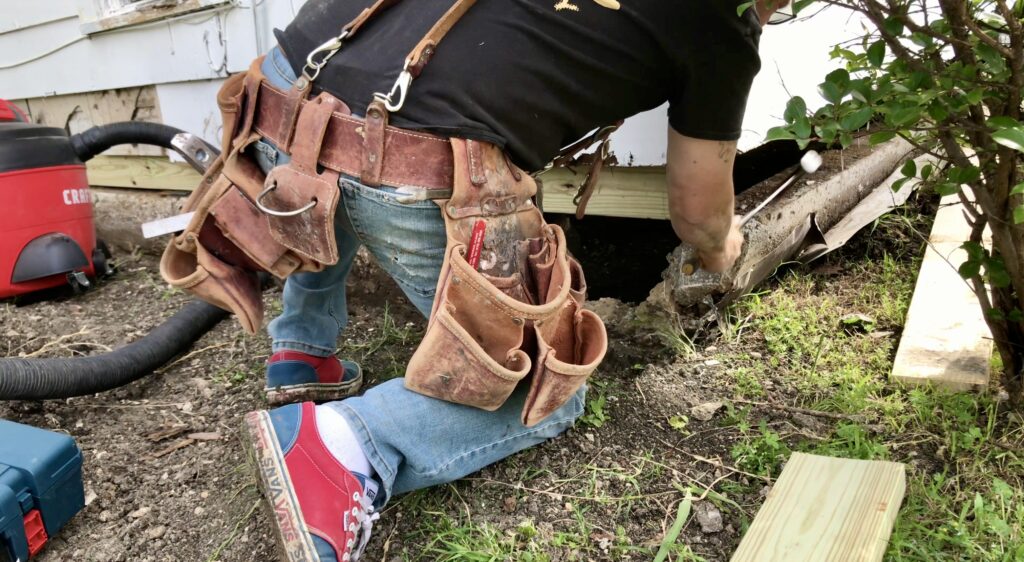
What are the coordinates of `sock` in the screenshot? It's located at (338, 444).